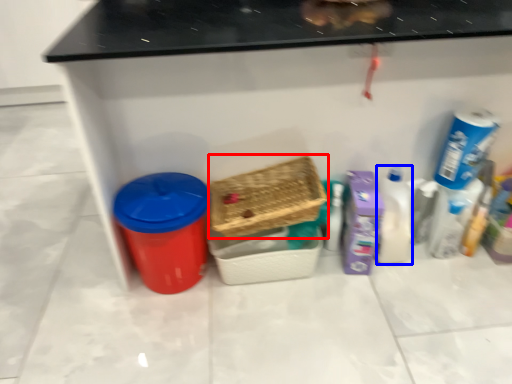
Question: Which of the following is the farthest to the observer, basket (highlighted by a red box) or cleaning product (highlighted by a blue box)?

Choices:
 (A) basket
 (B) cleaning product

Answer: (B)